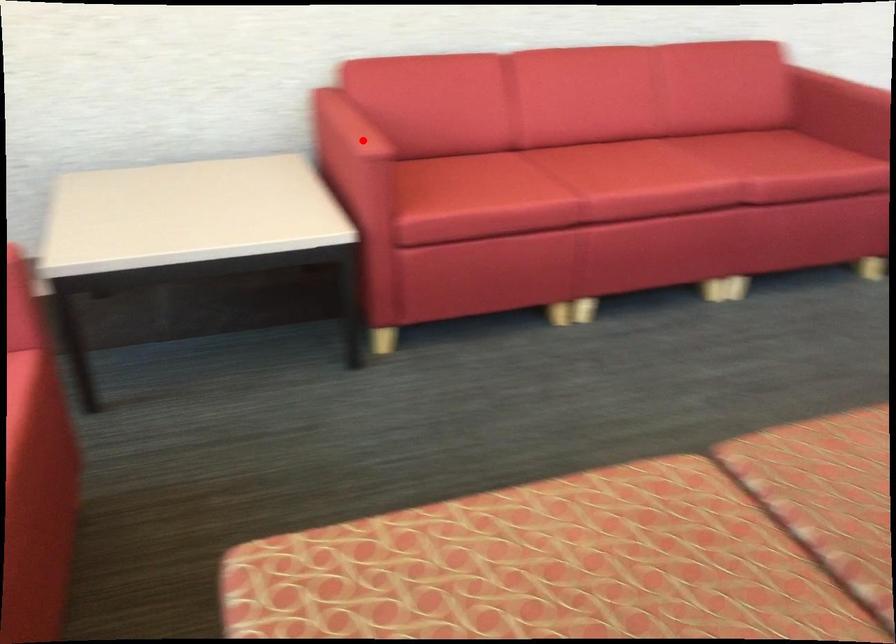
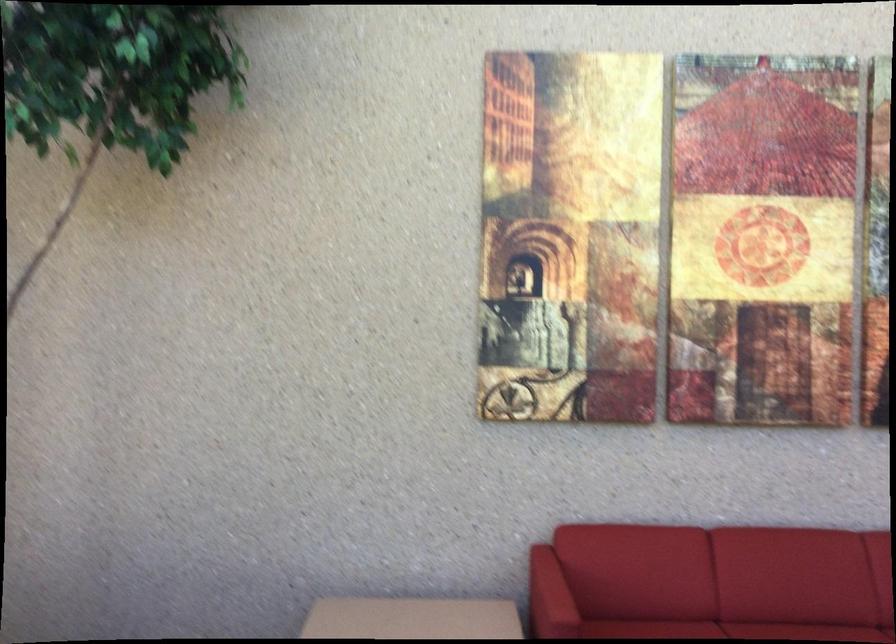
The point at the highlighted location is marked in the first image. Where is the corresponding point in the second image?

(549, 597)